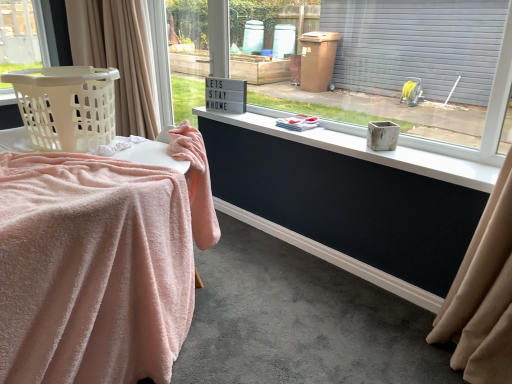
Question: Is beige fabric curtain at left to the right of matte concrete planter at center from the viewer's perspective?

Choices:
 (A) no
 (B) yes

Answer: (A)

Question: Does beige fabric curtain at left appear on the left side of matte concrete planter at center?

Choices:
 (A) no
 (B) yes

Answer: (B)

Question: Could matte concrete planter at center be considered to be inside beige fabric curtain at left?

Choices:
 (A) yes
 (B) no

Answer: (B)

Question: Does beige fabric curtain at left lie in front of matte concrete planter at center?

Choices:
 (A) no
 (B) yes

Answer: (A)

Question: Is beige fabric curtain at left facing away from matte concrete planter at center?

Choices:
 (A) no
 (B) yes

Answer: (A)

Question: Would you say white matte concrete at center is to the left or to the right of pink fluffy blanket at left in the picture?

Choices:
 (A) right
 (B) left

Answer: (A)

Question: Which is correct: white matte concrete at center is inside pink fluffy blanket at left, or outside of it?

Choices:
 (A) outside
 (B) inside

Answer: (A)

Question: Is point (208, 114) closer or farther from the camera than point (146, 160)?

Choices:
 (A) closer
 (B) farther

Answer: (B)

Question: Looking at their shapes, would you say white matte concrete at center is wider or thinner than pink fluffy blanket at left?

Choices:
 (A) wide
 (B) thin

Answer: (B)

Question: In terms of height, does pink fluffy blanket at left look taller or shorter compared to beige plastic laundry basket at left?

Choices:
 (A) tall
 (B) short

Answer: (A)

Question: Is point (145, 145) positioned closer to the camera than point (102, 84)?

Choices:
 (A) farther
 (B) closer

Answer: (A)

Question: From the image's perspective, is pink fluffy blanket at left positioned above or below beige plastic laundry basket at left?

Choices:
 (A) below
 (B) above

Answer: (A)

Question: Considering their positions, is pink fluffy blanket at left located in front of or behind beige plastic laundry basket at left?

Choices:
 (A) front
 (B) behind

Answer: (A)

Question: Is white matte concrete at center to the left or to the right of beige fabric curtain at left in the image?

Choices:
 (A) right
 (B) left

Answer: (A)

Question: Is white matte concrete at center situated inside beige fabric curtain at left or outside?

Choices:
 (A) outside
 (B) inside

Answer: (A)